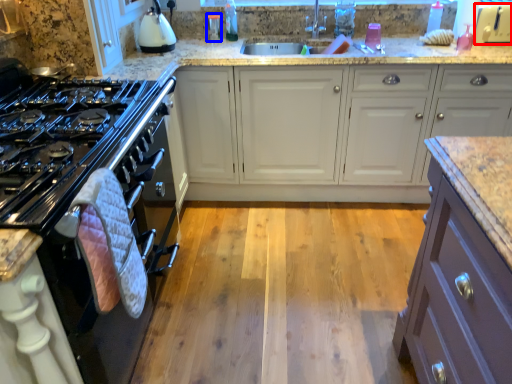
Question: Which object is closer to the camera taking this photo, appliance (highlighted by a red box) or appliance (highlighted by a blue box)?

Choices:
 (A) appliance
 (B) appliance

Answer: (A)